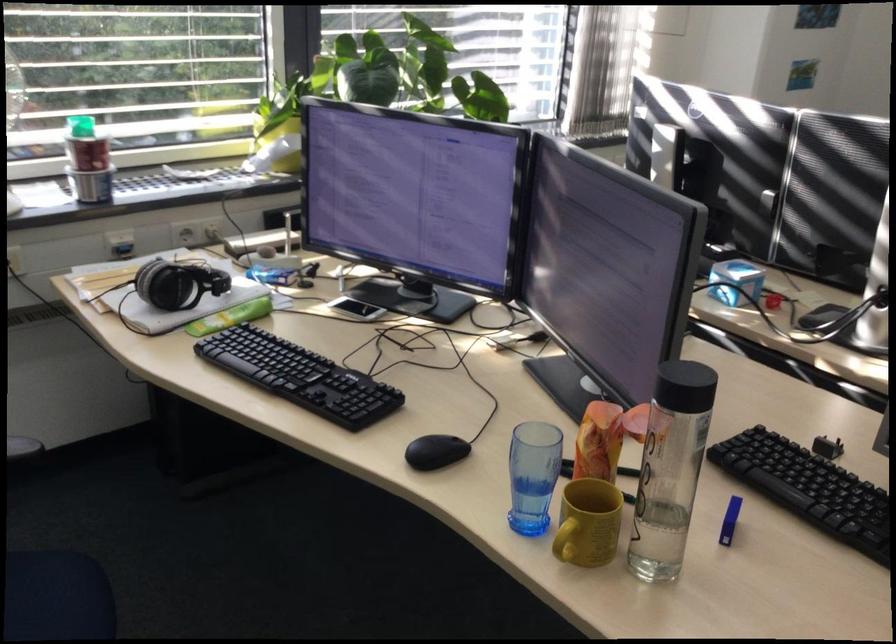
Describe the element at coordinates (435, 451) in the screenshot. The width and height of the screenshot is (896, 644). I see `the black computer mouse` at that location.